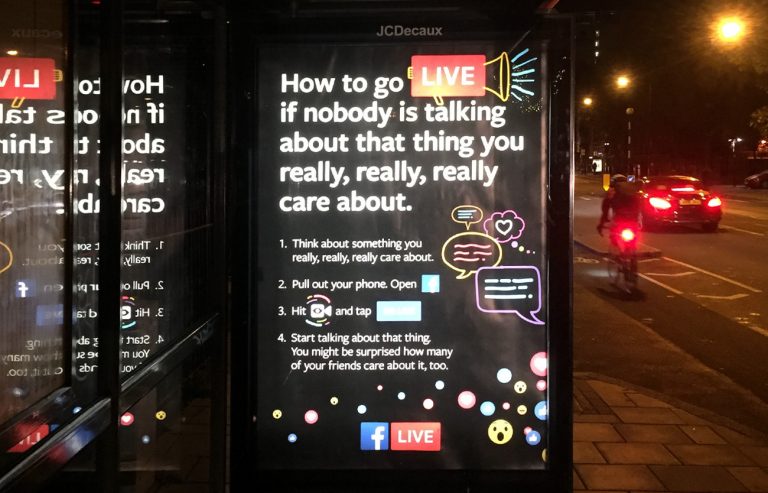
In order to click on lights in this screenshot , I will do `click(713, 203)`, `click(657, 204)`, `click(627, 235)`.